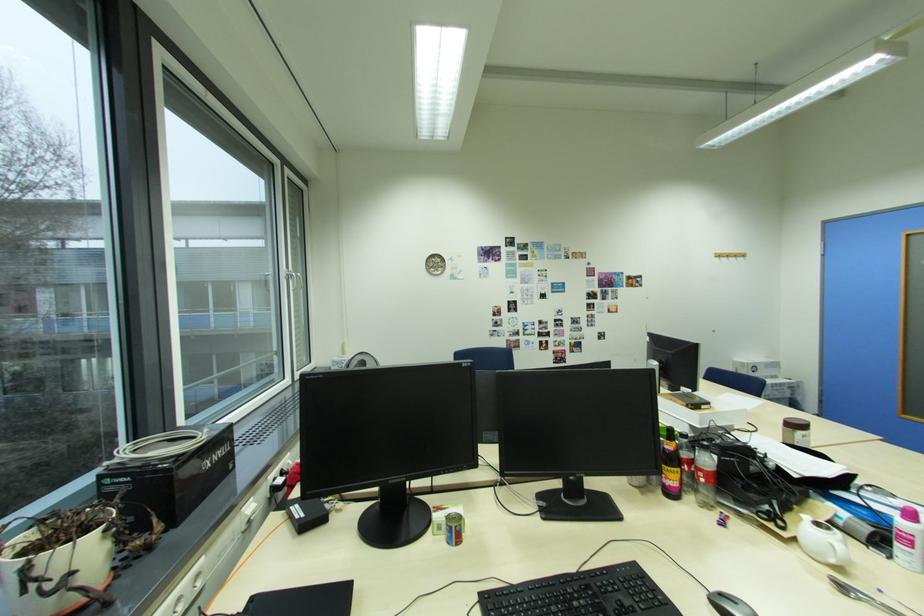
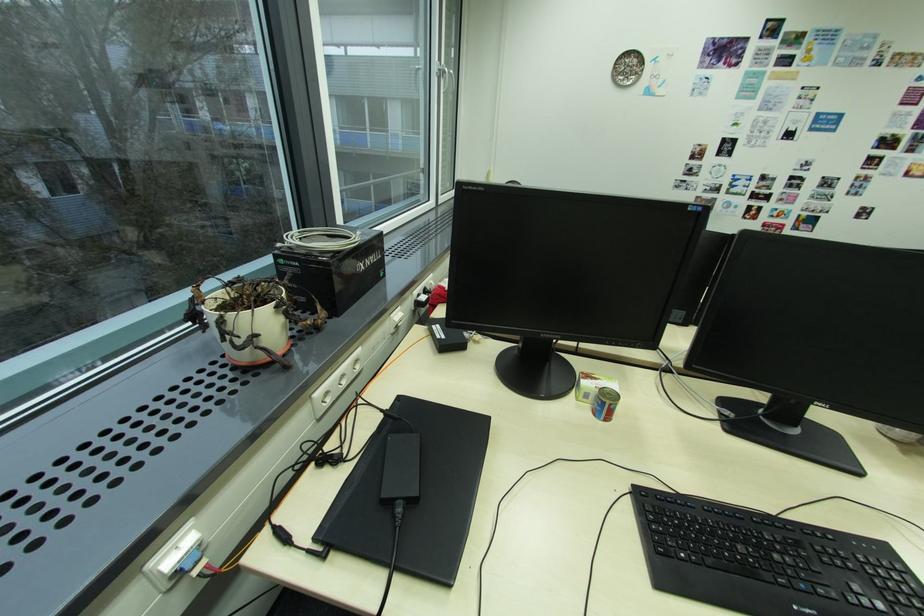
First-person continuous shooting, in which direction is the camera rotating?

The camera rotated toward left-down.